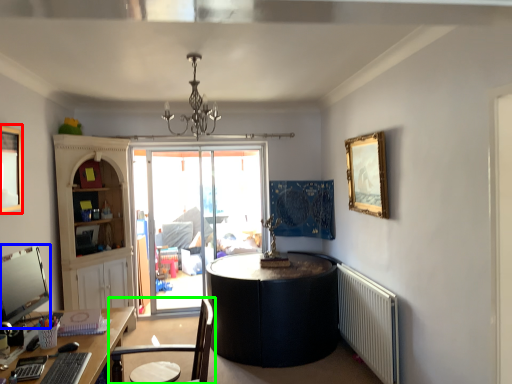
Question: Which object is the closest to the picture frame (highlighted by a red box)? Choose among these: computer monitor (highlighted by a blue box) or chair (highlighted by a green box).

Choices:
 (A) computer monitor
 (B) chair

Answer: (A)